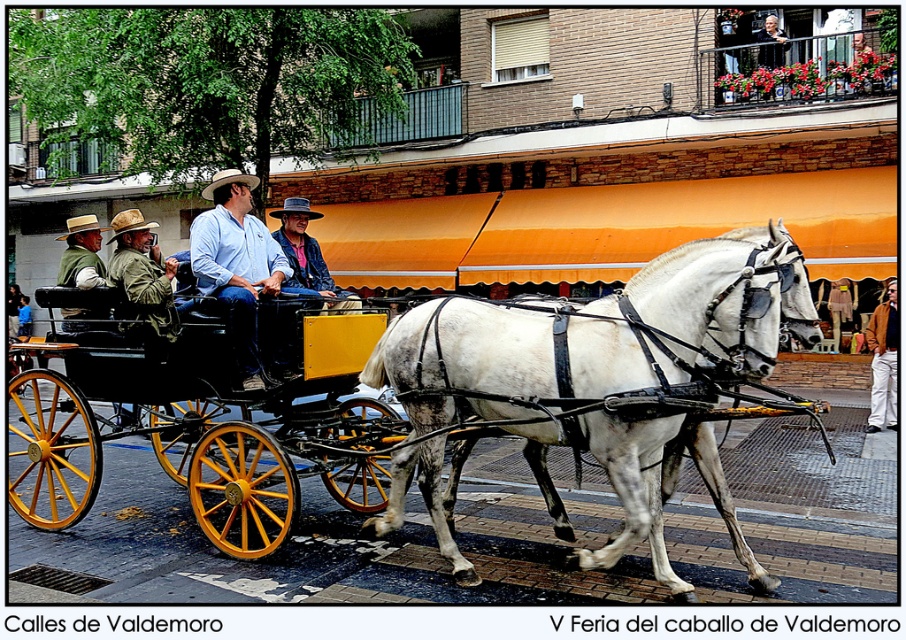
You are standing at the camera position and want to pick up the brown straw cowboy hat at upper left. Is it within a 30 feet distance?

The brown straw cowboy hat at upper left and camera are 26.57 feet apart, so yes, it is within 30 feet distance.

You are a photographer aiming to capture both the brown straw cowboy hat at upper left and the rustic straw cowboy hat at center in a single frame. Which hat will appear larger in the photo?

The brown straw cowboy hat at upper left will appear larger in the photo because it has a larger size compared to the rustic straw cowboy hat at center.

You are a photographer standing at the back of the carriage. You want to take a photo of both the green fabric jacket at left and the denim jacket at center. The camera you are using has a maximum focus range of 1.2 meters. Will both jackets be in focus?

The green fabric jacket at left is 1.19 meters from the denim jacket at center, so the distance between them is within the camera maximum focus range of 1.2 meters. Therefore, both jackets will be in focus.